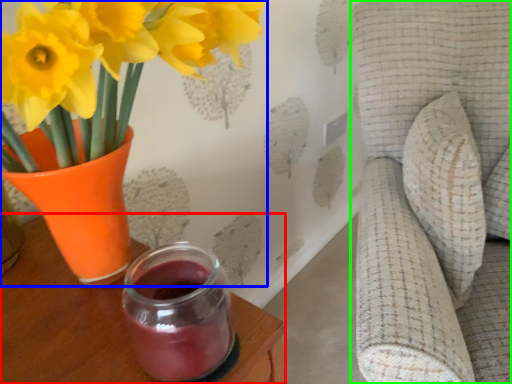
Question: Considering the real-world distances, which object is closest to table (highlighted by a red box)? houseplant (highlighted by a blue box) or swivel chair (highlighted by a green box).

Choices:
 (A) houseplant
 (B) swivel chair

Answer: (A)